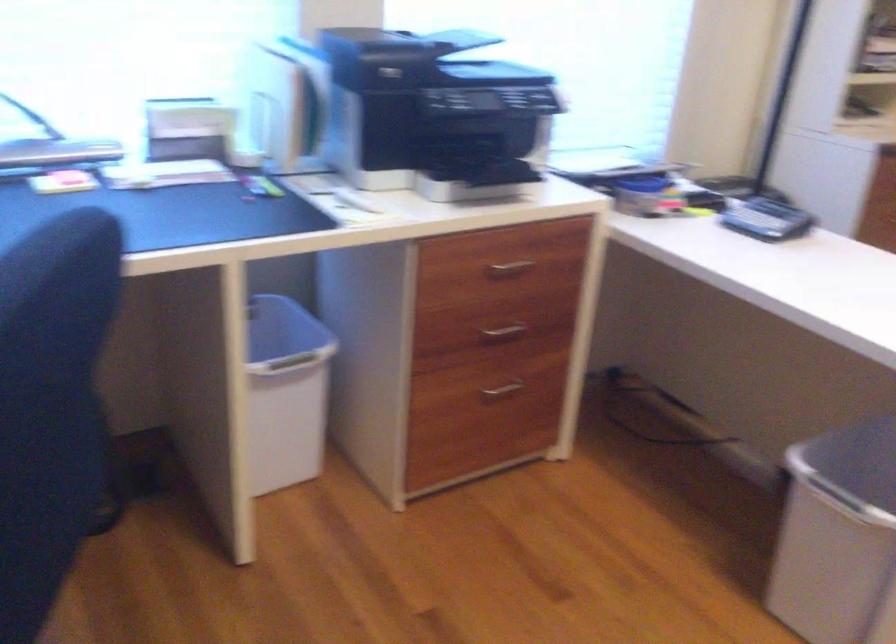
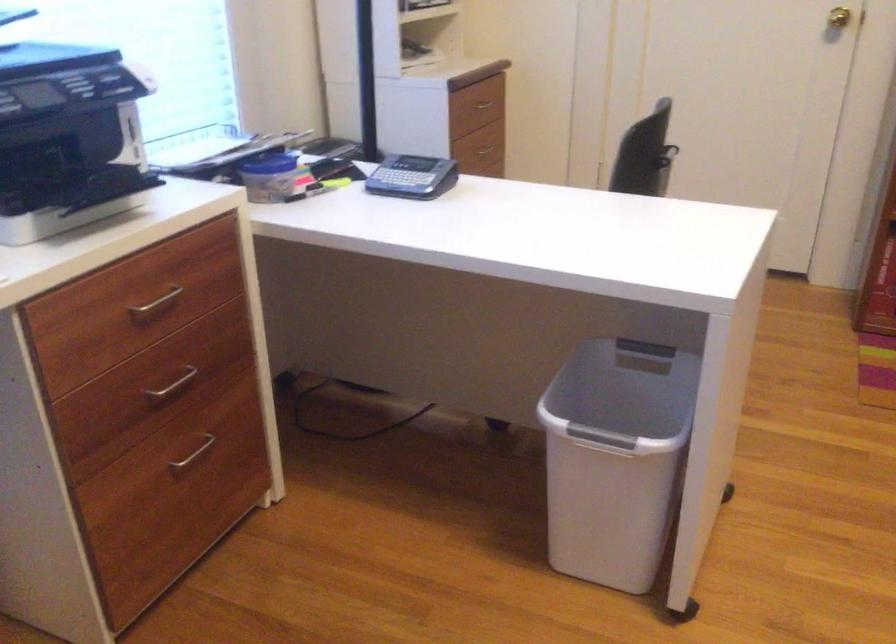
Find the pixel in the second image that matches pixel 509 263 in the first image.

(156, 303)